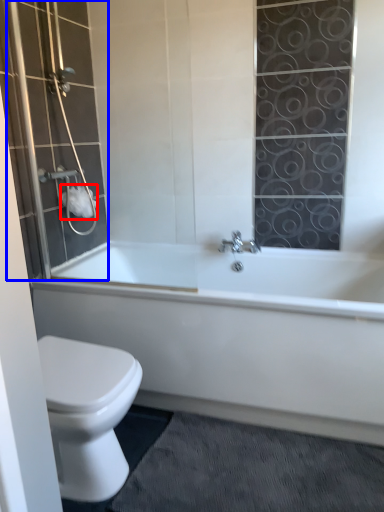
Question: Which point is further to the camera, toilet paper (highlighted by a red box) or shower door (highlighted by a blue box)?

Choices:
 (A) toilet paper
 (B) shower door

Answer: (A)